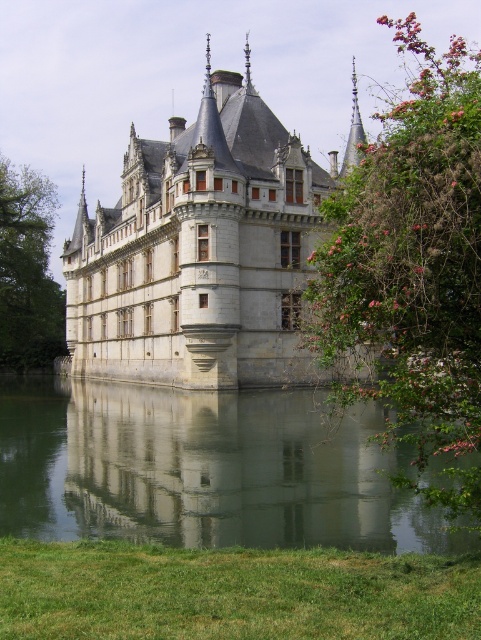
You are standing on the grassy area in front of the gray stone castle at center. If you want to walk to the transparent glass water at lower center, which direction should you move?

You should move to the left because the gray stone castle at center is to the right of the transparent glass water at lower center, so moving left will take you towards the water.

You are a visitor standing at the edge of the transparent glass water at lower center, looking towards the gray stone castle at center. Which object appears taller from your perspective?

The gray stone castle at center appears much taller than the transparent glass water at lower center from your perspective.